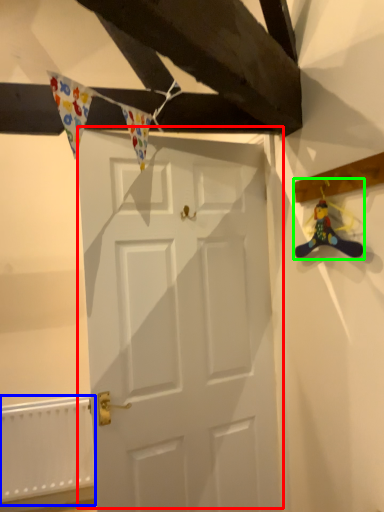
Question: Estimate the real-world distances between objects in this image. Which object is closer to door (highlighted by a red box), radiator (highlighted by a blue box) or miniature (highlighted by a green box)?

Choices:
 (A) radiator
 (B) miniature

Answer: (B)